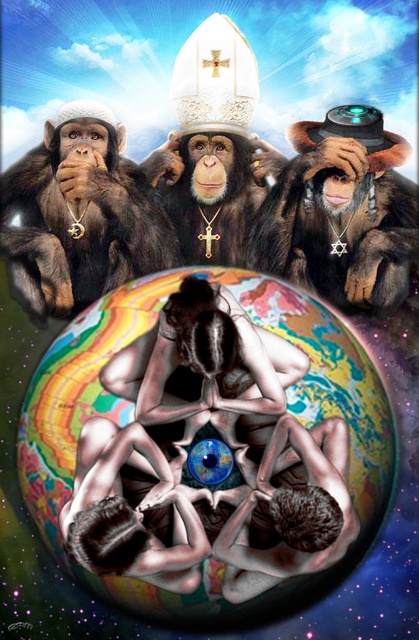
Can you confirm if metallic silver person at center is thinner than smooth skin figure at lower center?

Incorrect, metallic silver person at center's width is not less than smooth skin figure at lower center's.

This screenshot has width=419, height=640. What do you see at coordinates (219, 436) in the screenshot?
I see `metallic silver person at center` at bounding box center [219, 436].

Where is `metallic silver person at center`? This screenshot has width=419, height=640. metallic silver person at center is located at coordinates (219, 436).

Where is `metallic silver person at center`? metallic silver person at center is located at coordinates (219, 436).

Is metallic silver person at center to the right of shiny black hat at center from the viewer's perspective?

In fact, metallic silver person at center is to the left of shiny black hat at center.

Between point (108, 483) and point (343, 212), which one is positioned behind?

Positioned behind is point (343, 212).

Where is `metallic silver person at center`? The image size is (419, 640). metallic silver person at center is located at coordinates (219, 436).

Does metallic silver person at center have a greater width compared to shiny brown fur monkey at left?

Yes.

Locate an element on the screen. The height and width of the screenshot is (640, 419). metallic silver person at center is located at coordinates (219, 436).